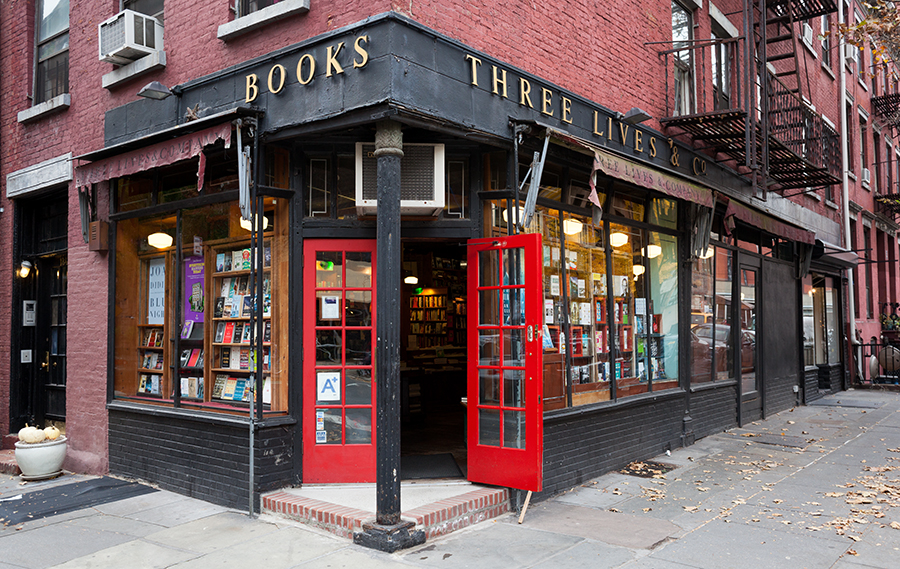
Where is `right door`? right door is located at coordinates (504, 465).